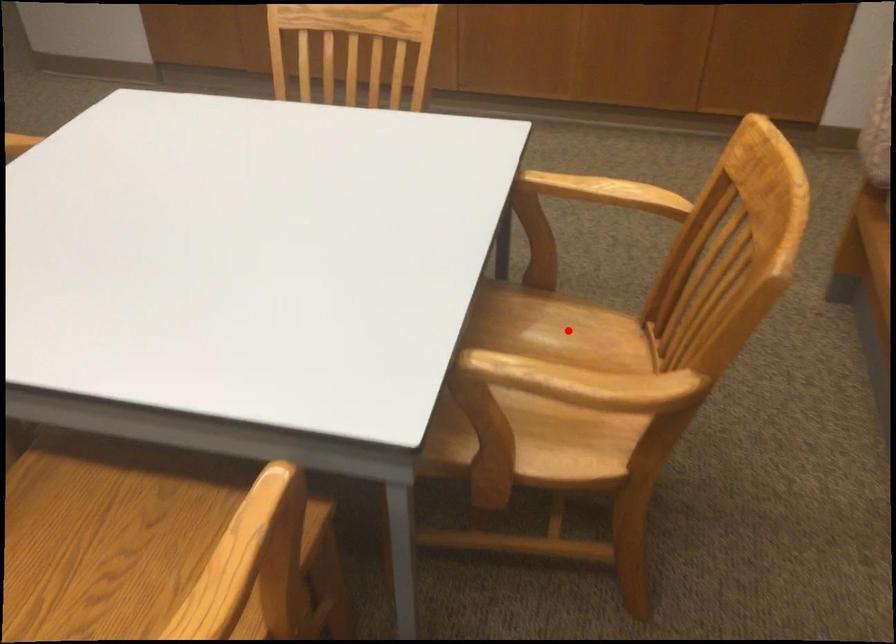
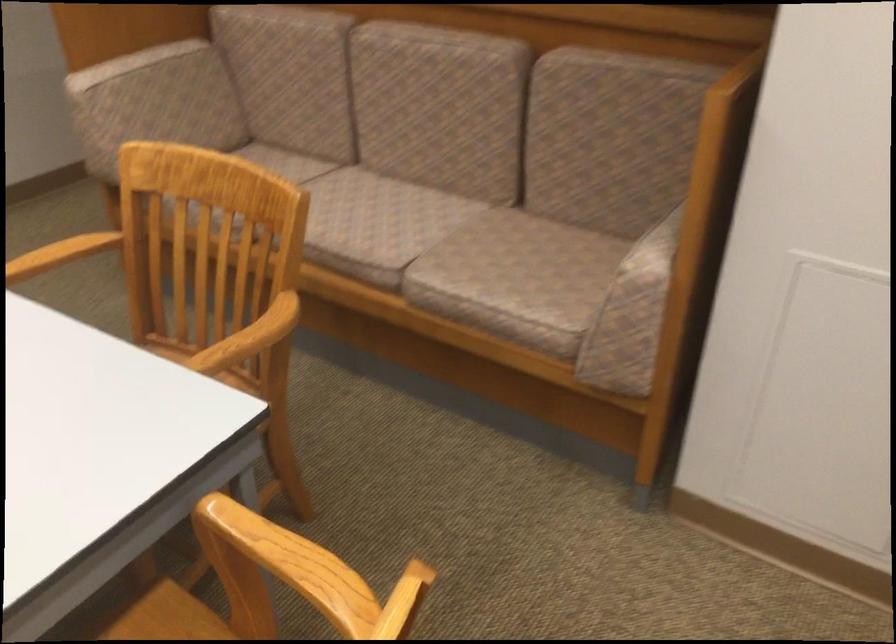
Question: I am providing you with two images of the same scene from different viewpoints. A red point is marked on the first image. Can you still see the location of the red point in image 2?

Choices:
 (A) Yes
 (B) No

Answer: (B)